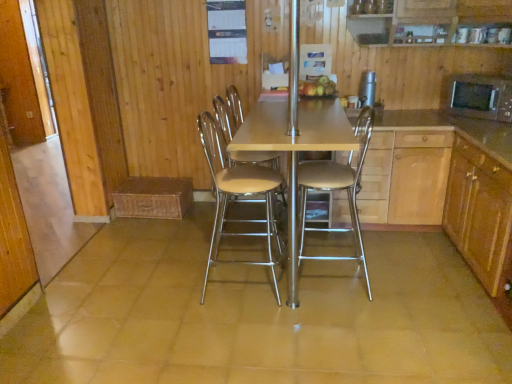
Question: From the image's perspective, does black matte microwave at right, the 2th appliance in the left-to-right sequence, appear higher than metallic beige stool at center, arranged as the second chair when viewed from the left?

Choices:
 (A) no
 (B) yes

Answer: (B)

Question: Can you confirm if black matte microwave at right, the 2th appliance in the left-to-right sequence, is positioned to the right of metallic beige stool at center, the 1th chair in the right-to-left sequence?

Choices:
 (A) yes
 (B) no

Answer: (A)

Question: From the image's perspective, is black matte microwave at right, the 2th appliance in the left-to-right sequence, below metallic beige stool at center, arranged as the second chair when viewed from the left?

Choices:
 (A) yes
 (B) no

Answer: (B)

Question: Is black matte microwave at right, the 2th appliance in the left-to-right sequence, wider than metallic beige stool at center, arranged as the second chair when viewed from the left?

Choices:
 (A) yes
 (B) no

Answer: (B)

Question: Is metallic beige stool at center, the 1th chair in the right-to-left sequence, located within black matte microwave at right, the first appliance viewed from the right?

Choices:
 (A) yes
 (B) no

Answer: (B)

Question: Considering the relative sizes of black matte microwave at right, the 2th appliance in the left-to-right sequence, and metallic beige stool at center, the 1th chair in the right-to-left sequence, in the image provided, is black matte microwave at right, the 2th appliance in the left-to-right sequence, shorter than metallic beige stool at center, the 1th chair in the right-to-left sequence,?

Choices:
 (A) yes
 (B) no

Answer: (A)

Question: Does metallic beige stool at center, arranged as the second chair when viewed from the left, lie behind beige leather chair at center, the 2th chair in the right-to-left sequence?

Choices:
 (A) no
 (B) yes

Answer: (B)

Question: From a real-world perspective, is metallic beige stool at center, arranged as the second chair when viewed from the left, positioned over beige leather chair at center, the 2th chair in the right-to-left sequence, based on gravity?

Choices:
 (A) no
 (B) yes

Answer: (B)

Question: Considering the relative sizes of metallic beige stool at center, the 1th chair in the right-to-left sequence, and beige leather chair at center, the 2th chair in the right-to-left sequence, in the image provided, is metallic beige stool at center, the 1th chair in the right-to-left sequence, bigger than beige leather chair at center, the 2th chair in the right-to-left sequence,?

Choices:
 (A) no
 (B) yes

Answer: (B)

Question: Is metallic beige stool at center, arranged as the second chair when viewed from the left, facing away from beige leather chair at center, the 1th chair positioned from the left?

Choices:
 (A) no
 (B) yes

Answer: (A)

Question: Can you confirm if metallic beige stool at center, the 1th chair in the right-to-left sequence, is wider than beige leather chair at center, the 1th chair positioned from the left?

Choices:
 (A) yes
 (B) no

Answer: (A)

Question: Are metallic beige stool at center, the 1th chair in the right-to-left sequence, and beige leather chair at center, the 2th chair in the right-to-left sequence, far apart?

Choices:
 (A) yes
 (B) no

Answer: (B)

Question: Is the position of matte wooden table at center more distant than that of shiny golden apples at center?

Choices:
 (A) yes
 (B) no

Answer: (B)